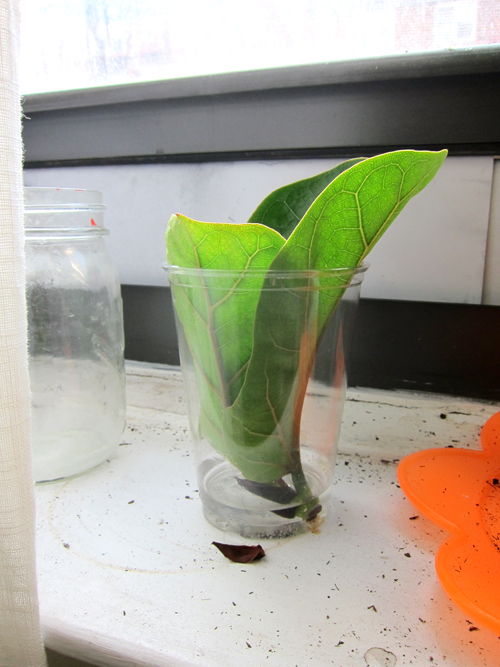
Where is `window sill (black)`? The height and width of the screenshot is (667, 500). window sill (black) is located at coordinates (350, 93).